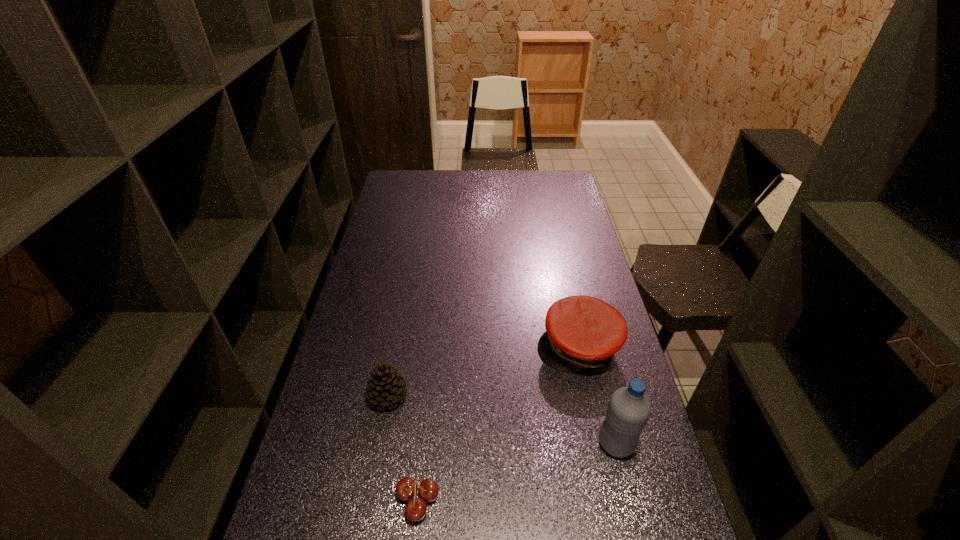
Identify the location of vacant space located 0.140m on the left of the second nearest object. The width and height of the screenshot is (960, 540). (544, 443).

This screenshot has height=540, width=960. What are the coordinates of `vacant region located at the front of the cap where the visor is located` in the screenshot? It's located at (543, 435).

Identify the location of vacant space positioned at the front of the cap where the visor is located. (547, 426).

I want to click on blank area located 0.350m at the front of the cap where the visor is located, so click(525, 484).

At what (x,y) coordinates should I click in order to perform the action: click on vacant position located at the narrow end of the pinecone. Please return your answer as a coordinate pair (x, y). Image resolution: width=960 pixels, height=540 pixels. Looking at the image, I should click on (506, 449).

The image size is (960, 540). Find the location of `blank space located 0.250m at the narrow end of the pinecone`. blank space located 0.250m at the narrow end of the pinecone is located at coordinates (485, 440).

Locate an element on the screen. This screenshot has height=540, width=960. free location located 0.270m at the narrow end of the pinecone is located at coordinates (492, 443).

This screenshot has width=960, height=540. In order to click on object present at the near edge in this screenshot , I will do `click(406, 488)`.

You are a GUI agent. You are given a task and a screenshot of the screen. Output one action in this format:
    pyautogui.click(x=<x>, y=<y>)
    Task: Click on the object that is at the left edge
    This screenshot has height=540, width=960.
    Given the screenshot: What is the action you would take?
    pyautogui.click(x=385, y=387)

Image resolution: width=960 pixels, height=540 pixels. Identify the location of water bottle positioned at the right edge. (628, 410).